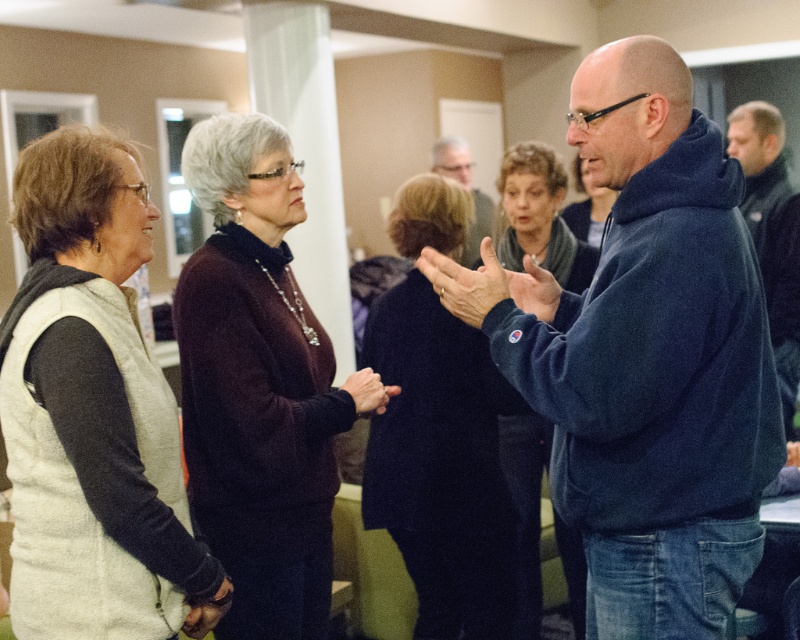
Between dark blue sweater at center and matte blue hand at center, which one appears on the right side from the viewer's perspective?

matte blue hand at center is more to the right.

Is dark blue sweater at center to the left of matte blue hand at center from the viewer's perspective?

Yes, dark blue sweater at center is to the left of matte blue hand at center.

At what (x,y) coordinates should I click in order to perform the action: click on dark blue sweater at center. Please return your answer as a coordinate pair (x, y). The image size is (800, 640). Looking at the image, I should click on (440, 464).

You are a GUI agent. You are given a task and a screenshot of the screen. Output one action in this format:
    pyautogui.click(x=<x>, y=<y>)
    Task: Click on the black fuzzy jacket at right
    
    Given the screenshot: What is the action you would take?
    pyautogui.click(x=772, y=232)

Is black fuzzy jacket at right to the right of matte blue hand at center from the viewer's perspective?

Yes, black fuzzy jacket at right is to the right of matte blue hand at center.

Between point (790, 428) and point (536, 285), which one is positioned in front?

Point (536, 285) is in front.

The height and width of the screenshot is (640, 800). What are the coordinates of `black fuzzy jacket at right` in the screenshot? It's located at (772, 232).

Can you confirm if dark maroon sweater at center is positioned to the left of matte black sweater at center?

Correct, you'll find dark maroon sweater at center to the left of matte black sweater at center.

Does dark maroon sweater at center appear over matte black sweater at center?

Actually, dark maroon sweater at center is below matte black sweater at center.

Measure the distance between dark maroon sweater at center and camera.

A distance of 1.99 meters exists between dark maroon sweater at center and camera.

Locate an element on the screen. This screenshot has height=640, width=800. dark maroon sweater at center is located at coordinates (256, 385).